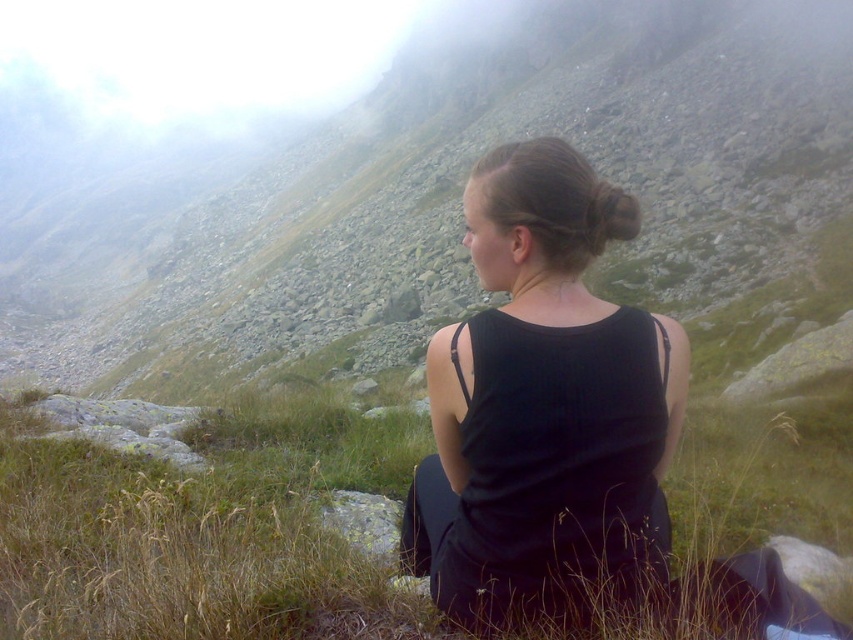
Question: Can you confirm if green grass at center is bigger than black matte dress at center?

Choices:
 (A) no
 (B) yes

Answer: (A)

Question: Which point appears farthest from the camera in this image?

Choices:
 (A) (573, 92)
 (B) (146, 468)

Answer: (A)

Question: Which object is positioned closest to the black matte dress at center?

Choices:
 (A) green grassy hillside at center
 (B) green grass at center

Answer: (B)

Question: Does green grass at center appear over black matte dress at center?

Choices:
 (A) no
 (B) yes

Answer: (A)

Question: Can you confirm if green grassy hillside at center is positioned to the left of black matte dress at center?

Choices:
 (A) no
 (B) yes

Answer: (B)

Question: Which point is farther to the camera?

Choices:
 (A) (440, 573)
 (B) (364, 168)

Answer: (B)